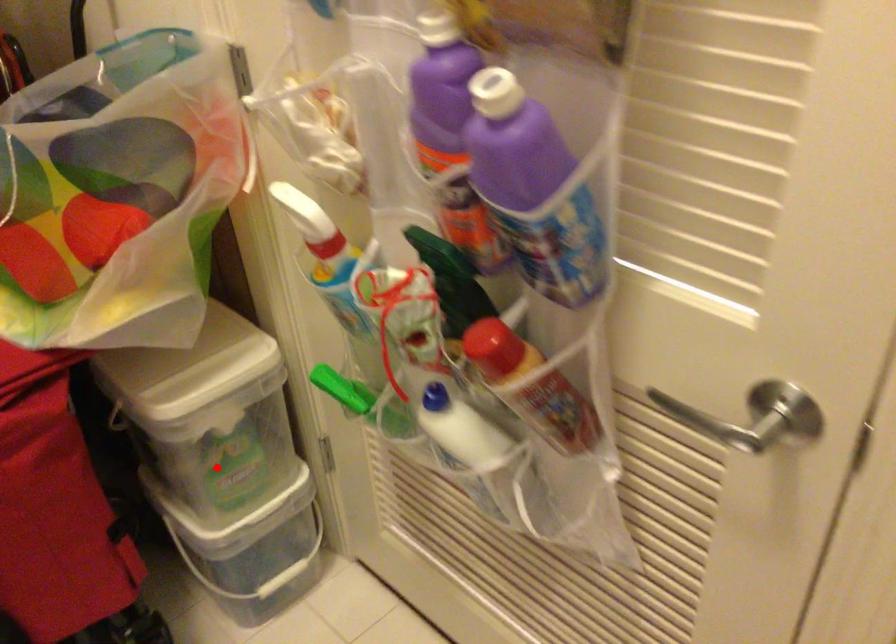
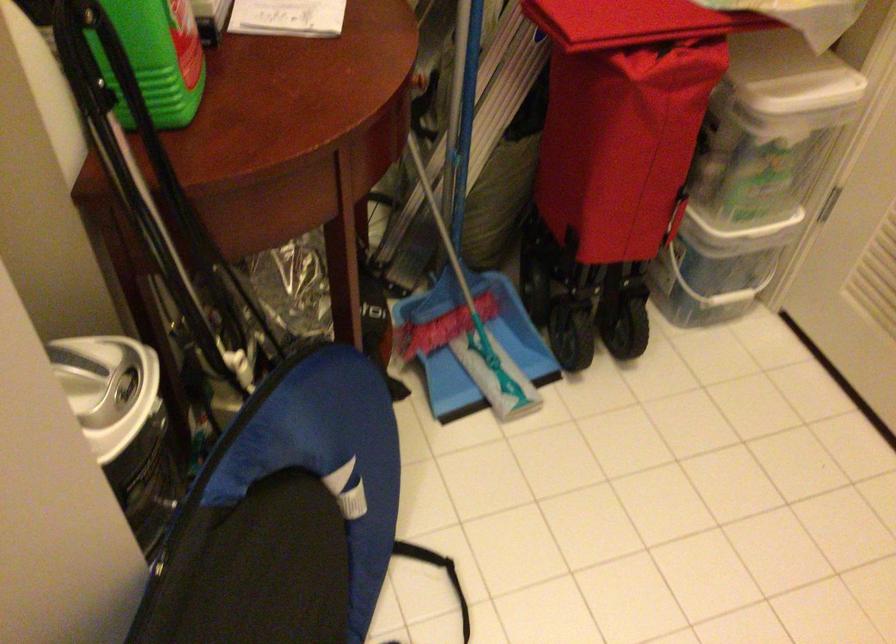
Question: I am providing you with two images of the same scene from different viewpoints. Given a red point in image1, look at the same physical point in image2. Is it:

Choices:
 (A) Closer to the viewpoint
 (B) Farther from the viewpoint

Answer: (B)